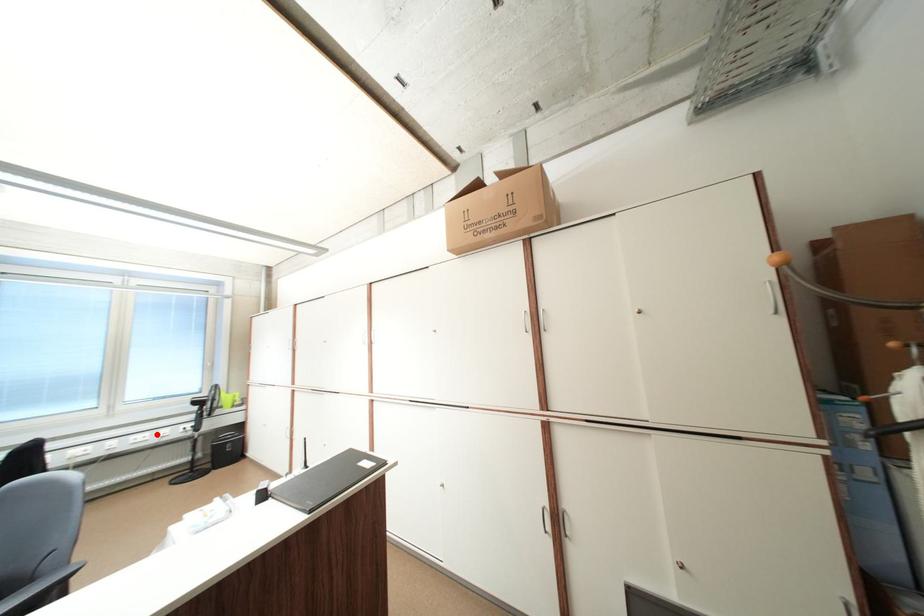
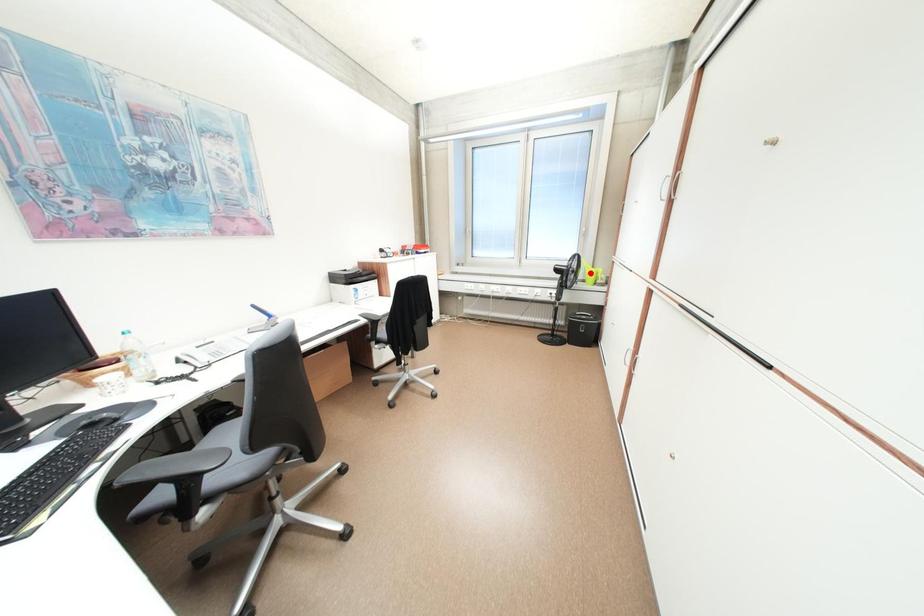
I am providing you with two images of the same scene from different viewpoints. A red point is marked on the first image and another point is marked on the second image. Do the highlighted points in image1 and image2 indicate the same real-world spot?

No